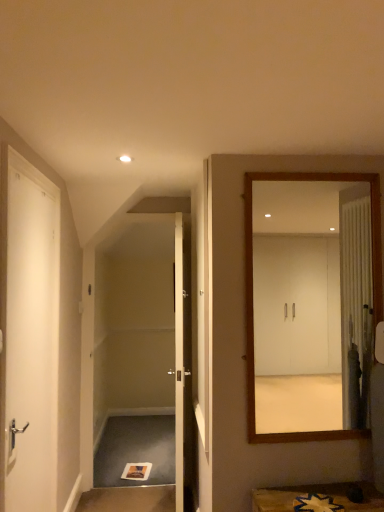
Question: Considering the relative positions of white matte door at left, marked as the 2th door in a right-to-left arrangement, and carpeted stair at lower left in the image provided, is white matte door at left, marked as the 2th door in a right-to-left arrangement, to the left or to the right of carpeted stair at lower left?

Choices:
 (A) right
 (B) left

Answer: (B)

Question: Is point (11, 202) closer or farther from the camera than point (119, 486)?

Choices:
 (A) closer
 (B) farther

Answer: (A)

Question: Which object is the farthest from the wooden mirror at right?

Choices:
 (A) white matte door at left, marked as the 2th door in a right-to-left arrangement
 (B) carpeted stair at lower left
 (C) white glossy door at center, which is the second door from left to right

Answer: (B)

Question: Which is farther from the wooden mirror at right?

Choices:
 (A) white matte door at left, which appears as the 2th door when viewed from the back
 (B) white glossy door at center, which is the second door from left to right
 (C) carpeted stair at lower left

Answer: (C)